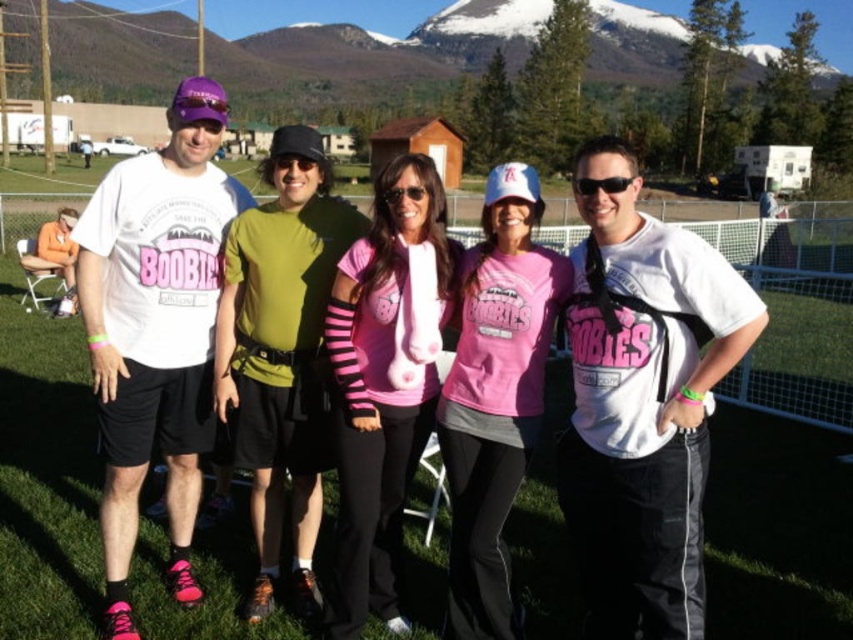
What do you see at coordinates (384, 384) in the screenshot?
I see `pink matte t-shirt at center` at bounding box center [384, 384].

Is pink matte t-shirt at center wider than pink matte shirt at center?

Yes, pink matte t-shirt at center is wider than pink matte shirt at center.

Where is `pink matte t-shirt at center`? This screenshot has height=640, width=853. pink matte t-shirt at center is located at coordinates (384, 384).

Which is more to the right, pink matte shirt at center or black plastic sunglasses at center?

black plastic sunglasses at center

Is point (462, 323) closer to viewer compared to point (587, 180)?

No, (462, 323) is further to viewer.

The height and width of the screenshot is (640, 853). I want to click on pink matte shirt at center, so click(x=495, y=396).

Identify the location of pink matte shirt at center. The height and width of the screenshot is (640, 853). [x=495, y=396].

Can you confirm if pink matte t-shirt at center is bigger than black plastic sunglasses at center?

Indeed, pink matte t-shirt at center has a larger size compared to black plastic sunglasses at center.

Who is shorter, pink matte t-shirt at center or black plastic sunglasses at center?

With less height is black plastic sunglasses at center.

Where is `pink matte t-shirt at center`? The width and height of the screenshot is (853, 640). pink matte t-shirt at center is located at coordinates (384, 384).

The height and width of the screenshot is (640, 853). In order to click on pink matte t-shirt at center in this screenshot , I will do `click(384, 384)`.